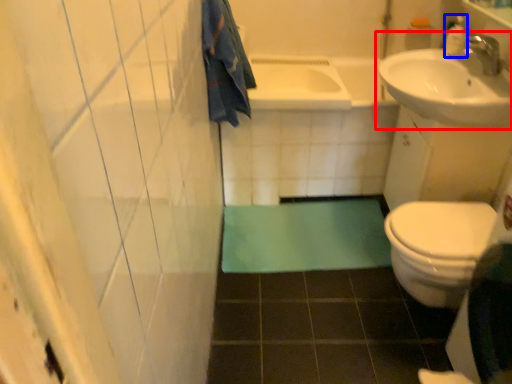
Question: Which object appears closest to the camera in this image, sink (highlighted by a red box) or toiletry (highlighted by a blue box)?

Choices:
 (A) sink
 (B) toiletry

Answer: (A)